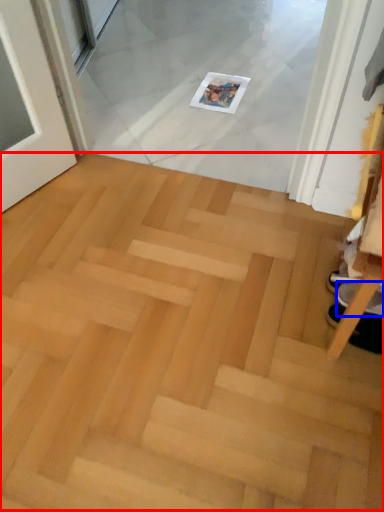
Question: Which point is further to the camera, stairwell (highlighted by a red box) or footwear (highlighted by a blue box)?

Choices:
 (A) stairwell
 (B) footwear

Answer: (B)